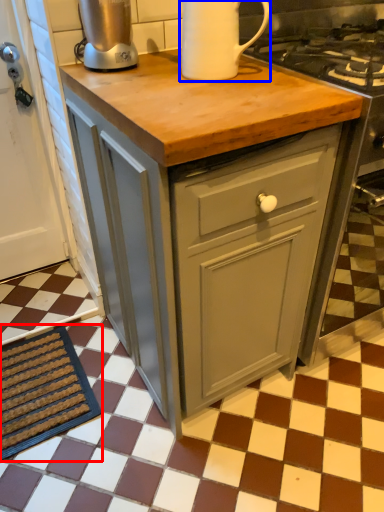
Question: Which object appears farthest to the camera in this image, doormat (highlighted by a red box) or kitchen appliance (highlighted by a blue box)?

Choices:
 (A) doormat
 (B) kitchen appliance

Answer: (A)